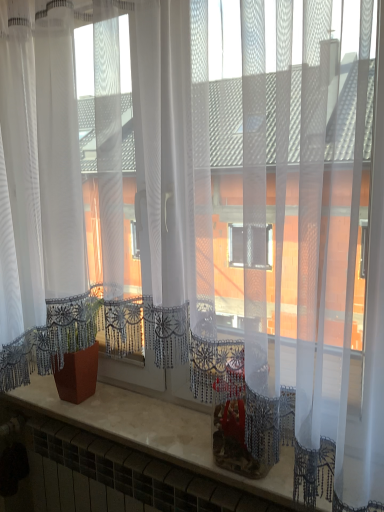
Locate an element on the screen. This screenshot has height=512, width=384. vacant space to the right of matte terracotta pot at lower left is located at coordinates (120, 402).